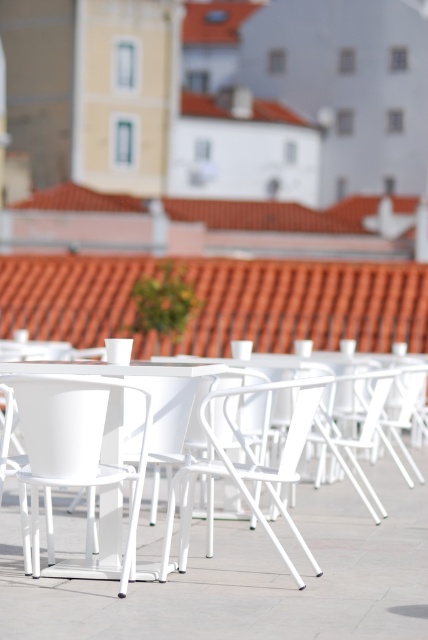
Question: Among these objects, which one is farthest from the camera?

Choices:
 (A) white metal chair at center
 (B) white metal/fabric folding chair at center

Answer: (A)

Question: Which of the following is the farthest from the observer?

Choices:
 (A) (226, 460)
 (B) (74, 572)
 (C) (130, 368)

Answer: (B)

Question: Can you confirm if white plastic table at center is bigger than white metal chair at center?

Choices:
 (A) yes
 (B) no

Answer: (A)

Question: Which of the following is the closest to the observer?

Choices:
 (A) (71, 561)
 (B) (189, 467)
 (C) (118, 492)

Answer: (B)

Question: Can you confirm if white plastic table at center is thinner than white metal chair at center?

Choices:
 (A) no
 (B) yes

Answer: (A)

Question: Observing the image, what is the correct spatial positioning of white plastic table at center in reference to white metal chair at center?

Choices:
 (A) below
 (B) above

Answer: (A)